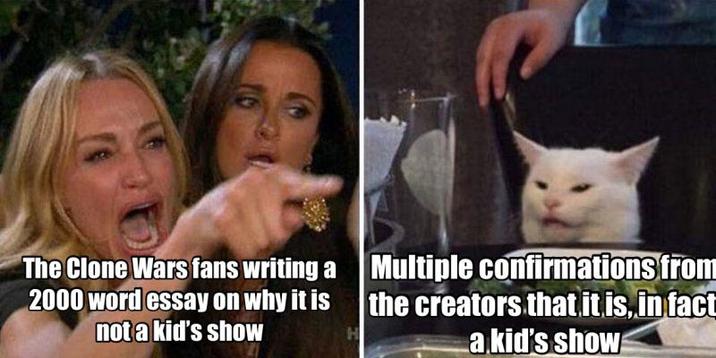
Find any what would hold a beverage in the picture. Your answer should be formatted as a list of tuples, i.e. [(x1, y1), (x2, y2), ...], where each tuple contains the x and y coordinates of a point satisfying the conditions above.

[(422, 231)]